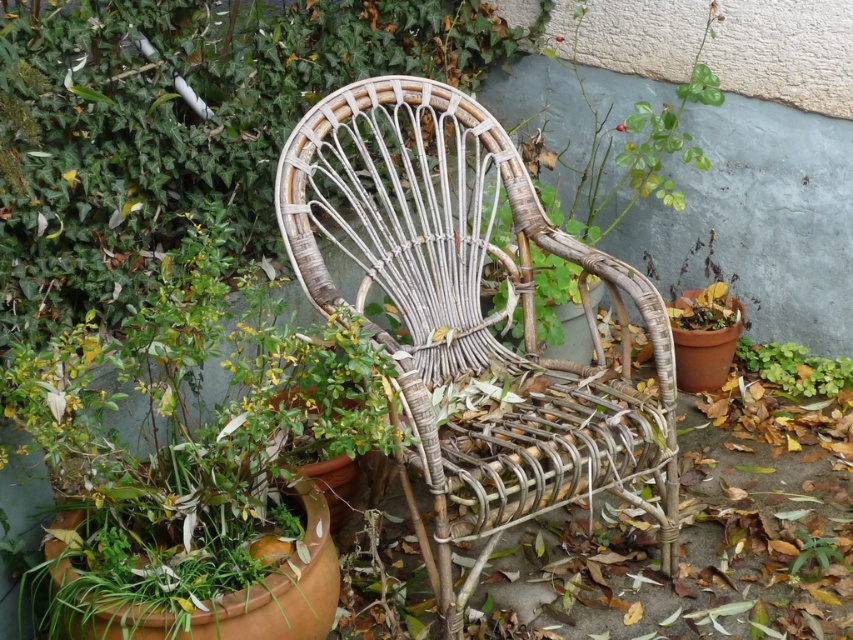
You are a gardener who needs to water both the woven bamboo chair at center and the green leafy plant at center. Your watering can has a maximum reach of 24 inches. Without moving either object, can you water both from your current position?

The distance between the woven bamboo chair at center and the green leafy plant at center is 24.30 inches. Since your watering can only reaches 24 inches, you cannot water both without moving them.

You are designing a garden layout and need to ensure that a small birdhouse you have, which requires a minimum of 1 meter of vertical clearance above it, can be placed near both the woven bamboo chair at center and the green leafy plant at center. Based on their heights, is this possible?

The woven bamboo chair at center is taller than the green leafy plant at center. Since the birdhouse needs at least 1 meter of vertical clearance, you must ensure that both the chair and the plant do not exceed this height. However, without specific measurements, we can only confirm their relative heights. If the taller woven bamboo chair at center meets the 1 meter requirement, then the plant also does. If the chair is under 1 meter, neither would qualify.